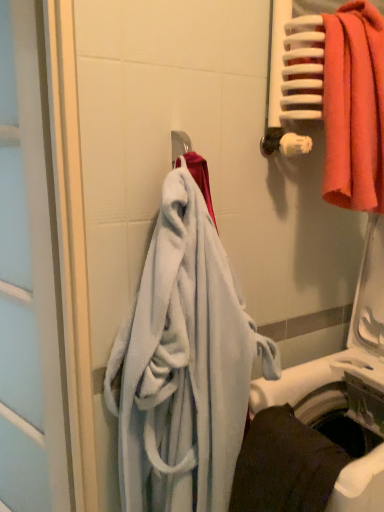
The width and height of the screenshot is (384, 512). I want to click on white plastic washing machine at lower right, so click(342, 358).

The height and width of the screenshot is (512, 384). I want to click on dark gray fabric towel at lower right, which is counted as the first towel, starting from the bottom, so click(284, 465).

This screenshot has height=512, width=384. Identify the location of white glossy screen door at left. pos(31,288).

Where is `white plastic washing machine at lower right`? The height and width of the screenshot is (512, 384). white plastic washing machine at lower right is located at coordinates (342, 358).

Is dark gray fabric towel at lower right, which is counted as the first towel, starting from the bottom, not inside white plastic washing machine at lower right?

No, dark gray fabric towel at lower right, which is counted as the first towel, starting from the bottom, is inside or overlapping with white plastic washing machine at lower right.

Considering the sizes of dark gray fabric towel at lower right, which is counted as the first towel, starting from the bottom, and white plastic washing machine at lower right in the image, is dark gray fabric towel at lower right, which is counted as the first towel, starting from the bottom, taller or shorter than white plastic washing machine at lower right?

Considering their sizes, dark gray fabric towel at lower right, which is counted as the first towel, starting from the bottom, has less height than white plastic washing machine at lower right.

Looking at this image, considering the relative positions of dark gray fabric towel at lower right, the 3th towel positioned from the top, and white plastic washing machine at lower right in the image provided, is dark gray fabric towel at lower right, the 3th towel positioned from the top, to the left of white plastic washing machine at lower right from the viewer's perspective?

Yes.

Is dark gray fabric towel at lower right, which is counted as the first towel, starting from the bottom, smaller than white plastic washing machine at lower right?

Indeed, dark gray fabric towel at lower right, which is counted as the first towel, starting from the bottom, has a smaller size compared to white plastic washing machine at lower right.

Does white glossy screen door at left turn towards dark gray fabric towel at lower right, the 3th towel positioned from the top?

No, white glossy screen door at left is not aimed at dark gray fabric towel at lower right, the 3th towel positioned from the top.

Based on the photo, how many degrees apart are the facing directions of white glossy screen door at left and dark gray fabric towel at lower right, which is counted as the first towel, starting from the bottom?

18.9 degrees separate the facing orientations of white glossy screen door at left and dark gray fabric towel at lower right, which is counted as the first towel, starting from the bottom.

Which is correct: white glossy screen door at left is inside dark gray fabric towel at lower right, the 3th towel positioned from the top, or outside of it?

white glossy screen door at left exists outside the volume of dark gray fabric towel at lower right, the 3th towel positioned from the top.

Can you confirm if white glossy screen door at left is positioned to the right of dark gray fabric towel at lower right, the 3th towel positioned from the top?

No, white glossy screen door at left is not to the right of dark gray fabric towel at lower right, the 3th towel positioned from the top.

Is dark gray fabric towel at lower right, which is counted as the first towel, starting from the bottom, oriented towards white glossy screen door at left?

No, dark gray fabric towel at lower right, which is counted as the first towel, starting from the bottom, is not oriented towards white glossy screen door at left.

In the image, is dark gray fabric towel at lower right, which is counted as the first towel, starting from the bottom, positioned in front of or behind white glossy screen door at left?

Visually, dark gray fabric towel at lower right, which is counted as the first towel, starting from the bottom, is located in front of white glossy screen door at left.

Consider the image. Considering the relative sizes of dark gray fabric towel at lower right, the 3th towel positioned from the top, and white glossy screen door at left in the image provided, is dark gray fabric towel at lower right, the 3th towel positioned from the top, taller than white glossy screen door at left?

No.

Is dark gray fabric towel at lower right, which is counted as the first towel, starting from the bottom, surrounding white glossy screen door at left?

No.

Between matte orange towel at upper right, marked as the first towel in a top-to-bottom arrangement, and soft blue towel at center, the 2th towel when ordered from bottom to top, which one has larger size?

soft blue towel at center, the 2th towel when ordered from bottom to top.

From a real-world perspective, which object rests below the other?

soft blue towel at center, the 2th towel when ordered from bottom to top, is physically lower.

From the image's perspective, between matte orange towel at upper right, the third towel from the bottom, and soft blue towel at center, the 2th towel when ordered from bottom to top, which one is located above?

matte orange towel at upper right, the third towel from the bottom.

How many degrees apart are the facing directions of matte orange towel at upper right, the third towel from the bottom, and soft blue towel at center, the 2th towel when ordered from bottom to top?

The angle between the facing direction of matte orange towel at upper right, the third towel from the bottom, and the facing direction of soft blue towel at center, the 2th towel when ordered from bottom to top, is 92.8 degrees.

From a real-world perspective, who is located lower, white glossy screen door at left or white plastic washing machine at lower right?

white plastic washing machine at lower right.

Is white glossy screen door at left not near white plastic washing machine at lower right?

white glossy screen door at left is near white plastic washing machine at lower right, not far away.

How distant is white glossy screen door at left from white plastic washing machine at lower right?

They are 77.11 centimeters apart.

Which point is more distant from viewer, (14,467) or (382,100)?

The point (14,467) is farther.

Is matte orange towel at upper right, marked as the first towel in a top-to-bottom arrangement, a part of white glossy screen door at left?

No, matte orange towel at upper right, marked as the first towel in a top-to-bottom arrangement, is not a part of white glossy screen door at left.

Considering the sizes of objects white glossy screen door at left and matte orange towel at upper right, marked as the first towel in a top-to-bottom arrangement, in the image provided, who is smaller, white glossy screen door at left or matte orange towel at upper right, marked as the first towel in a top-to-bottom arrangement,?

matte orange towel at upper right, marked as the first towel in a top-to-bottom arrangement.

Is white glossy screen door at left beside matte orange towel at upper right, marked as the first towel in a top-to-bottom arrangement?

white glossy screen door at left and matte orange towel at upper right, marked as the first towel in a top-to-bottom arrangement, are not in contact.

From a real-world perspective, is soft blue towel at center, acting as the 2th towel starting from the top, positioned under dark gray fabric towel at lower right, the 3th towel positioned from the top, based on gravity?

No, from a real-world perspective, soft blue towel at center, acting as the 2th towel starting from the top, is not under dark gray fabric towel at lower right, the 3th towel positioned from the top.

Between point (165, 216) and point (287, 446), which one is positioned in front?

The point (165, 216) is in front.

Is soft blue towel at center, the 2th towel when ordered from bottom to top, looking in the opposite direction of dark gray fabric towel at lower right, which is counted as the first towel, starting from the bottom?

No, soft blue towel at center, the 2th towel when ordered from bottom to top, is not facing away from dark gray fabric towel at lower right, which is counted as the first towel, starting from the bottom.

The width and height of the screenshot is (384, 512). What are the coordinates of `washing machine above the dark gray fabric towel at lower right, the 3th towel positioned from the top (from a real-world perspective)` in the screenshot? It's located at (342, 358).

Locate an element on the screen. screen door to the left of dark gray fabric towel at lower right, which is counted as the first towel, starting from the bottom is located at coordinates (31, 288).

Considering their positions, is white plastic washing machine at lower right positioned further to soft blue towel at center, acting as the 2th towel starting from the top, than dark gray fabric towel at lower right, the 3th towel positioned from the top?

white plastic washing machine at lower right lies further to soft blue towel at center, acting as the 2th towel starting from the top, than the other object.

Estimate the real-world distances between objects in this image. Which object is further from dark gray fabric towel at lower right, which is counted as the first towel, starting from the bottom, soft blue towel at center, the 2th towel when ordered from bottom to top, or white glossy screen door at left?

Based on the image, white glossy screen door at left appears to be further to dark gray fabric towel at lower right, which is counted as the first towel, starting from the bottom.

Based on their spatial positions, is white glossy screen door at left or matte orange towel at upper right, marked as the first towel in a top-to-bottom arrangement, further from dark gray fabric towel at lower right, the 3th towel positioned from the top?

matte orange towel at upper right, marked as the first towel in a top-to-bottom arrangement, is positioned further to the anchor dark gray fabric towel at lower right, the 3th towel positioned from the top.

In the scene shown: Based on their spatial positions, is dark gray fabric towel at lower right, the 3th towel positioned from the top, or matte orange towel at upper right, the third towel from the bottom, further from white plastic washing machine at lower right?

matte orange towel at upper right, the third towel from the bottom, is further to white plastic washing machine at lower right.

Considering their positions, is matte orange towel at upper right, the third towel from the bottom, positioned further to white plastic washing machine at lower right than dark gray fabric towel at lower right, the 3th towel positioned from the top?

The object further to white plastic washing machine at lower right is matte orange towel at upper right, the third towel from the bottom.

Consider the image. Which object lies further to the anchor point dark gray fabric towel at lower right, which is counted as the first towel, starting from the bottom, white glossy screen door at left or soft blue towel at center, the 2th towel when ordered from bottom to top?

white glossy screen door at left is positioned further to the anchor dark gray fabric towel at lower right, which is counted as the first towel, starting from the bottom.

When comparing their distances from white glossy screen door at left, does soft blue towel at center, acting as the 2th towel starting from the top, or dark gray fabric towel at lower right, the 3th towel positioned from the top, seem further?

dark gray fabric towel at lower right, the 3th towel positioned from the top, is further to white glossy screen door at left.

Based on their spatial positions, is soft blue towel at center, the 2th towel when ordered from bottom to top, or white plastic washing machine at lower right closer to white glossy screen door at left?

soft blue towel at center, the 2th towel when ordered from bottom to top, lies closer to white glossy screen door at left than the other object.

Where is `towel between white glossy screen door at left and dark gray fabric towel at lower right, which is counted as the first towel, starting from the bottom, from left to right`? towel between white glossy screen door at left and dark gray fabric towel at lower right, which is counted as the first towel, starting from the bottom, from left to right is located at coordinates (183, 365).

Locate an element on the screen. towel between matte orange towel at upper right, the third towel from the bottom, and dark gray fabric towel at lower right, which is counted as the first towel, starting from the bottom, in the vertical direction is located at coordinates click(x=183, y=365).

Where is `towel between matte orange towel at upper right, the third towel from the bottom, and white plastic washing machine at lower right in the up-down direction`? The width and height of the screenshot is (384, 512). towel between matte orange towel at upper right, the third towel from the bottom, and white plastic washing machine at lower right in the up-down direction is located at coordinates (183, 365).

You are a GUI agent. You are given a task and a screenshot of the screen. Output one action in this format:
    pyautogui.click(x=<x>, y=<y>)
    Task: Click on the washing machine between matte orange towel at upper right, the third towel from the bottom, and dark gray fabric towel at lower right, the 3th towel positioned from the top, in the vertical direction
    The width and height of the screenshot is (384, 512).
    Given the screenshot: What is the action you would take?
    pyautogui.click(x=342, y=358)